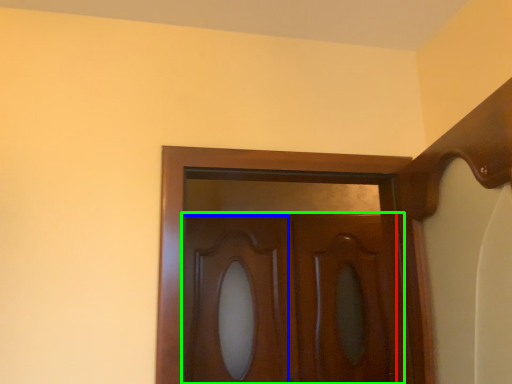
Question: Estimate the real-world distances between objects in this image. Which object is closer to screen door (highlighted by a red box), cabinetry (highlighted by a blue box) or door (highlighted by a green box)?

Choices:
 (A) cabinetry
 (B) door

Answer: (B)